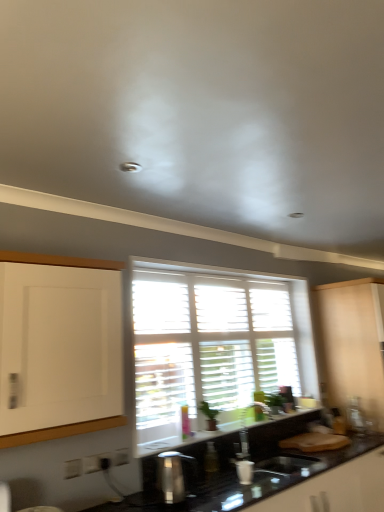
Find the location of a particular element. vacant space underneath metallic silver soap dispenser at lower center, which is the 2th appliance in right-to-left order (from a real-world perspective) is located at coordinates (189, 503).